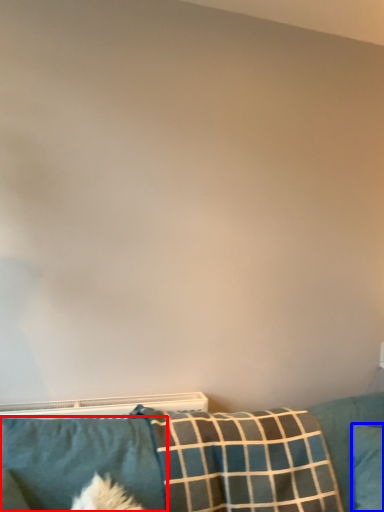
Question: Which of the following is the farthest to the observer, pillow (highlighted by a red box) or pillow (highlighted by a blue box)?

Choices:
 (A) pillow
 (B) pillow

Answer: (B)